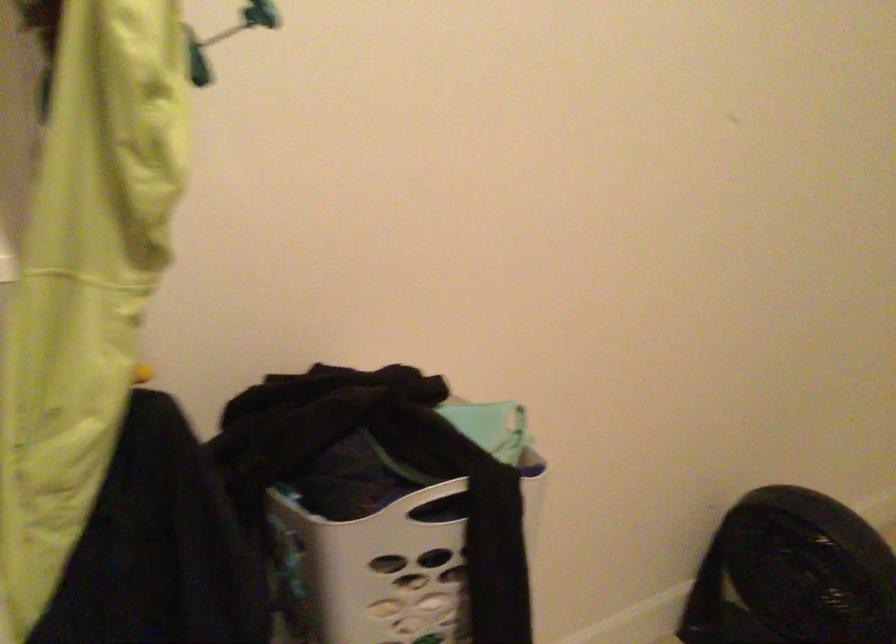
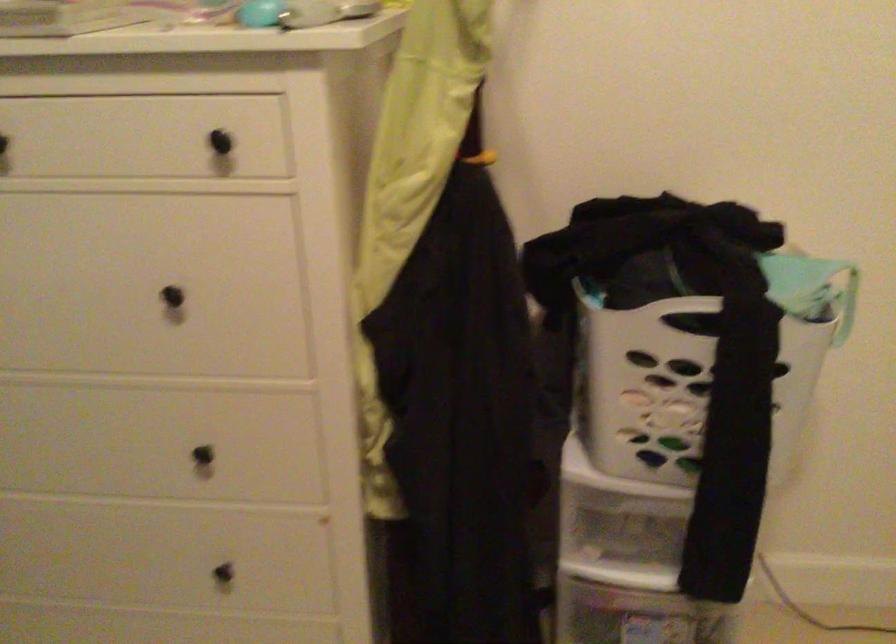
The point at (x=492, y=406) is marked in the first image. Where is the corresponding point in the second image?

(825, 261)